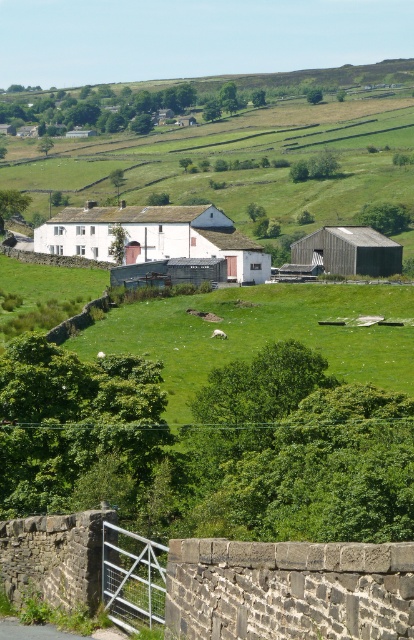
Question: Does white matte barn at center lie behind wooden barn at center?

Choices:
 (A) yes
 (B) no

Answer: (B)

Question: Is white matte barn at center wider than wooden barn at center?

Choices:
 (A) yes
 (B) no

Answer: (A)

Question: Among these objects, which one is nearest to the camera?

Choices:
 (A) wooden barn at center
 (B) white matte barn at center

Answer: (B)

Question: Can you confirm if white matte barn at center is positioned below wooden barn at center?

Choices:
 (A) yes
 (B) no

Answer: (B)

Question: Among these objects, which one is nearest to the camera?

Choices:
 (A) white matte barn at center
 (B) wooden barn at center

Answer: (A)